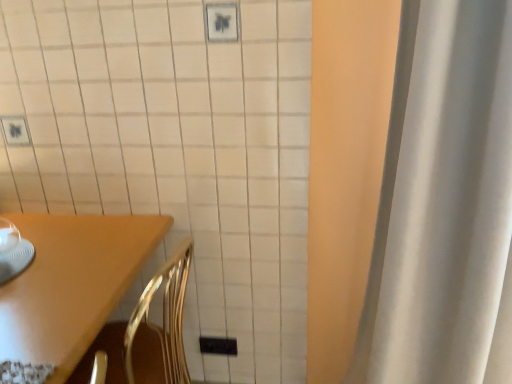
Question: Do you think wooden table at lower left is within white fabric curtain at right, or outside of it?

Choices:
 (A) inside
 (B) outside

Answer: (B)

Question: Looking at the image, does wooden table at lower left seem bigger or smaller compared to white fabric curtain at right?

Choices:
 (A) small
 (B) big

Answer: (B)

Question: Considering the positions of point (22, 301) and point (407, 319), is point (22, 301) closer or farther from the camera than point (407, 319)?

Choices:
 (A) closer
 (B) farther

Answer: (A)

Question: From a real-world perspective, is white fabric curtain at right positioned above or below wooden table at lower left?

Choices:
 (A) above
 (B) below

Answer: (A)

Question: Looking at their shapes, would you say white fabric curtain at right is wider or thinner than wooden table at lower left?

Choices:
 (A) wide
 (B) thin

Answer: (B)

Question: In the image, is white fabric curtain at right positioned in front of or behind wooden table at lower left?

Choices:
 (A) behind
 (B) front

Answer: (B)

Question: Is white fabric curtain at right to the left or to the right of wooden table at lower left in the image?

Choices:
 (A) right
 (B) left

Answer: (A)